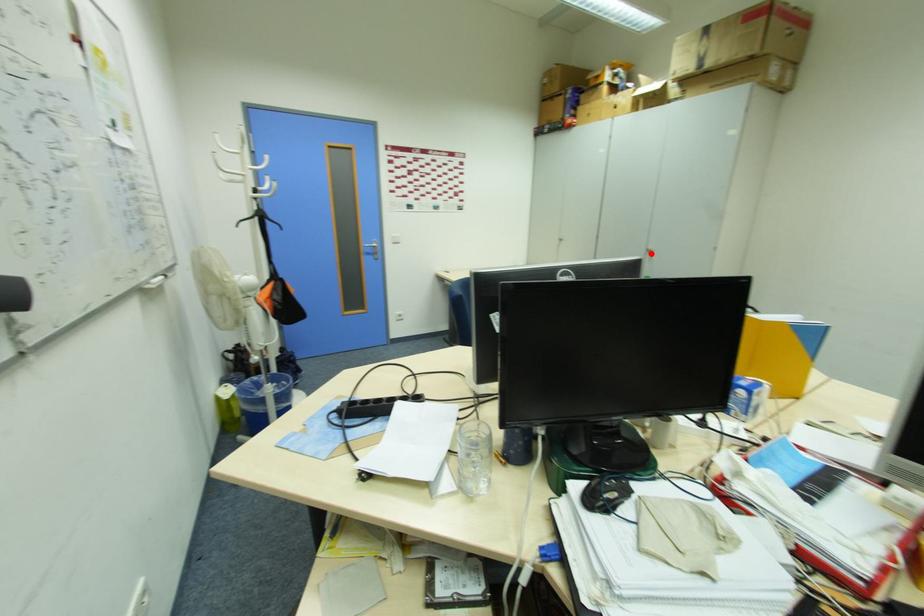
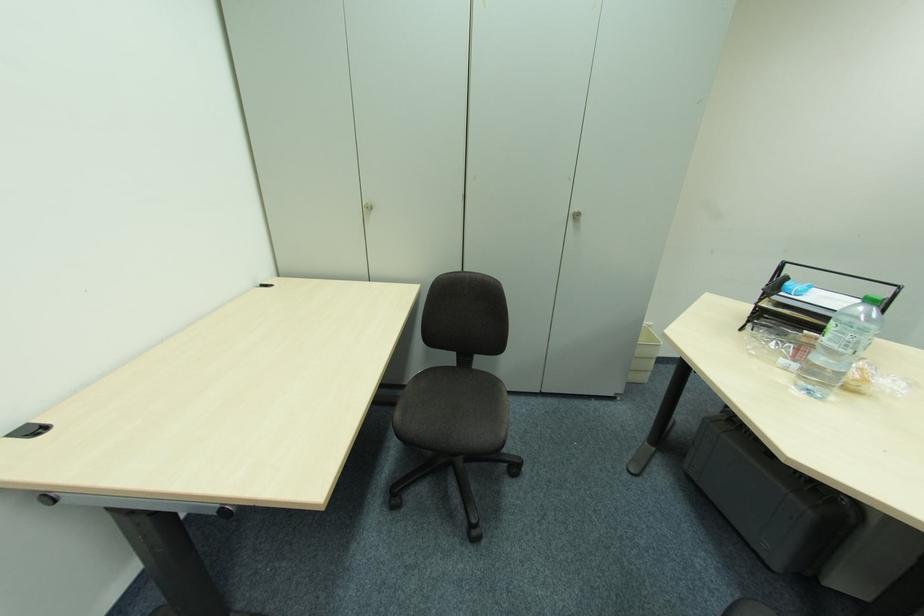
The point at the highlighted location is marked in the first image. Where is the corresponding point in the second image?

(574, 219)